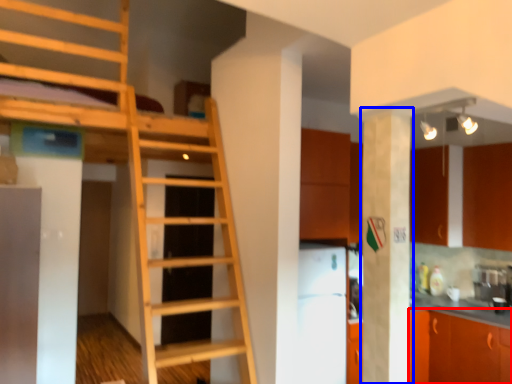
Question: Which object is further to the camera taking this photo, cabinetry (highlighted by a red box) or pillar (highlighted by a blue box)?

Choices:
 (A) cabinetry
 (B) pillar

Answer: (A)